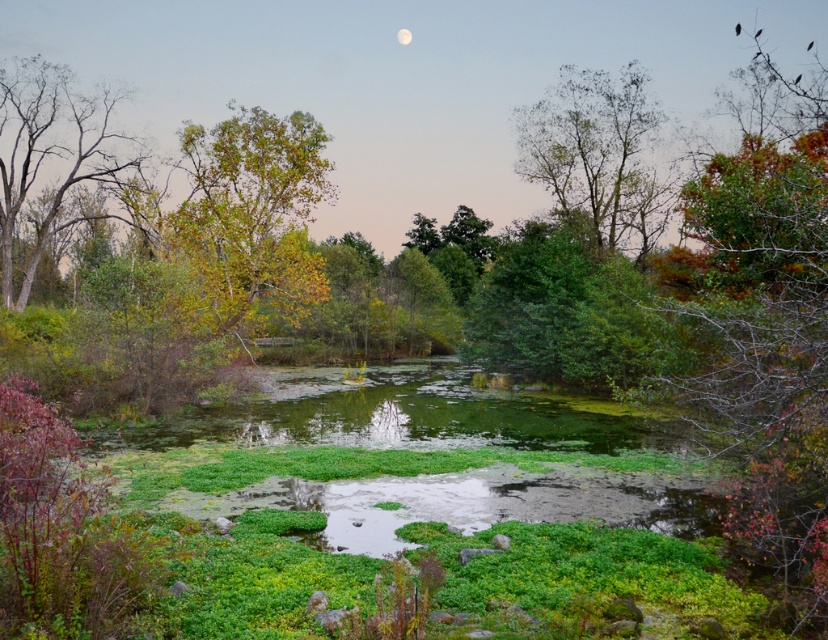
Question: Can you confirm if bare wood tree at left is wider than white glossy moon at upper center?

Choices:
 (A) no
 (B) yes

Answer: (B)

Question: Which point is closer to the camera?

Choices:
 (A) (215, 138)
 (B) (634, 97)

Answer: (B)

Question: Does green leafy tree at upper center lie in front of white glossy moon at upper center?

Choices:
 (A) no
 (B) yes

Answer: (B)

Question: Considering the real-world distances, which object is closest to the white glossy moon at upper center?

Choices:
 (A) green leafy tree at center
 (B) bare wood tree at left

Answer: (A)

Question: In this image, where is green leafy tree at center located relative to green leafy tree at upper center?

Choices:
 (A) below
 (B) above

Answer: (A)

Question: Which object appears farthest from the camera in this image?

Choices:
 (A) bare wood tree at left
 (B) white glossy moon at upper center
 (C) green leafy tree at upper center

Answer: (B)